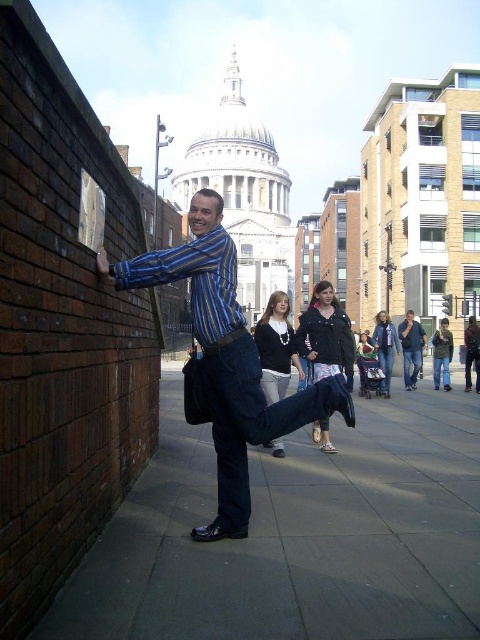
Question: Does denim jacket at center have a lesser width compared to dark blue jeans at center?

Choices:
 (A) no
 (B) yes

Answer: (A)

Question: Is dark blue denim jeans at center thinner than jeans at right?

Choices:
 (A) yes
 (B) no

Answer: (B)

Question: Which of the following is the closest to the observer?

Choices:
 (A) (236, 476)
 (B) (439, 374)
 (C) (317, 298)
 (D) (463, 531)

Answer: (D)

Question: Which of the following is the closest to the observer?

Choices:
 (A) (407, 348)
 (B) (243, 499)
 (C) (445, 344)
 (D) (179, 589)

Answer: (D)

Question: Which of the following is the closest to the observer?

Choices:
 (A) denim jacket at center
 (B) gray concrete pavement at lower center
 (C) blue striped shirt at center
 (D) jeans at right

Answer: (B)

Question: Is gray concrete pavement at lower center in front of dark blue denim jeans at center?

Choices:
 (A) yes
 (B) no

Answer: (A)